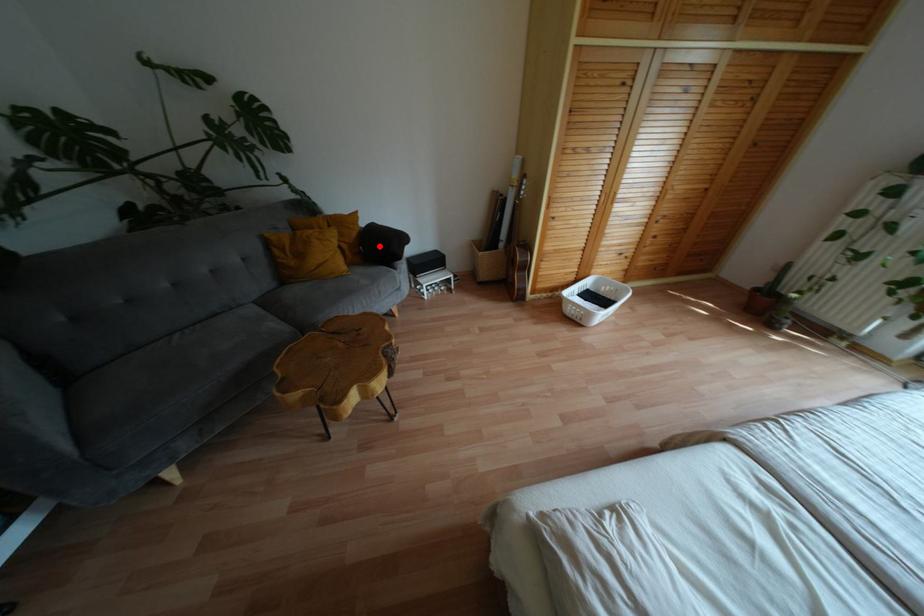
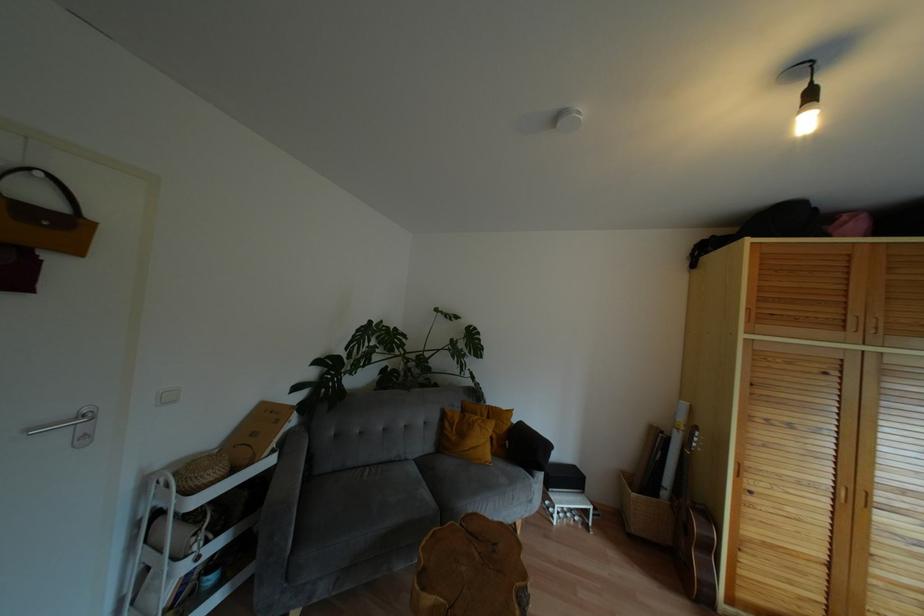
Find the pixel in the second image that matches the highlighted location in the first image.

(524, 448)